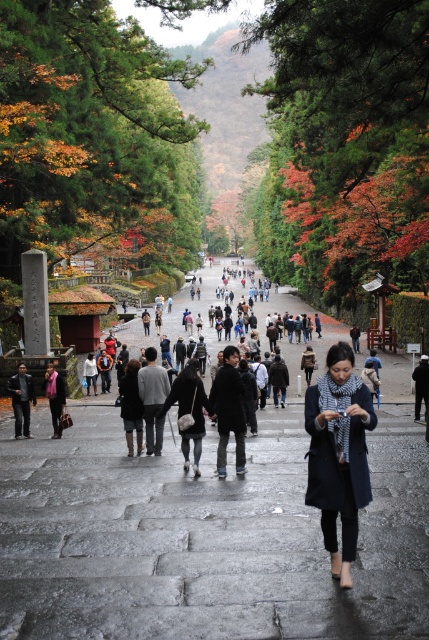
Who is lower down, dark blue wool coat at center or brown leather jacket at center?

Positioned lower is brown leather jacket at center.

The width and height of the screenshot is (429, 640). In order to click on dark blue wool coat at center in this screenshot , I will do `click(229, 410)`.

Is point (227, 401) less distant than point (307, 368)?

Yes.

At what (x,y) coordinates should I click in order to perform the action: click on dark blue wool coat at center. Please return your answer as a coordinate pair (x, y). Looking at the image, I should click on (229, 410).

Who is lower down, blue woolen scarf at center or dark blue wool coat at center?

Positioned lower is dark blue wool coat at center.

Which is behind, point (326, 506) or point (232, 404)?

The point (232, 404) is more distant.

Image resolution: width=429 pixels, height=640 pixels. Describe the element at coordinates (338, 452) in the screenshot. I see `blue woolen scarf at center` at that location.

Find the location of a particular element. blue woolen scarf at center is located at coordinates (338, 452).

Does stone paved pathway at center have a greater width compared to pink fabric scarf at center?

Yes, stone paved pathway at center is wider than pink fabric scarf at center.

Does stone paved pathway at center appear on the left side of pink fabric scarf at center?

No, stone paved pathway at center is not to the left of pink fabric scarf at center.

Which is in front, point (205, 435) or point (54, 433)?

Positioned in front is point (205, 435).

Where is `stone paved pathway at center`? This screenshot has height=640, width=429. stone paved pathway at center is located at coordinates (204, 534).